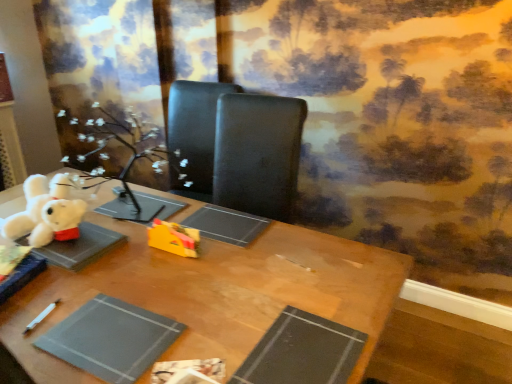
At what (x,y) coordinates should I click in order to perform the action: click on vacant space that is to the left of yellow plastic toy at center, which appears as the second toy when viewed from the left. Please return your answer as a coordinate pair (x, y). Looking at the image, I should click on (124, 253).